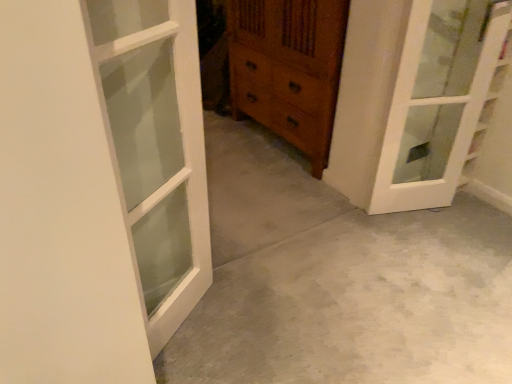
Question: Looking at the image, does wooden chest of drawers at center seem bigger or smaller compared to white glass door at upper right, which is counted as the first door, starting from the right?

Choices:
 (A) small
 (B) big

Answer: (B)

Question: Looking at their shapes, would you say wooden chest of drawers at center is wider or thinner than white glass door at upper right, which is counted as the first door, starting from the right?

Choices:
 (A) thin
 (B) wide

Answer: (B)

Question: Considering the real-world distances, which object is closest to the gray concrete at center?

Choices:
 (A) wooden chest of drawers at center
 (B) white wood door at left, placed as the 1th door when sorted from left to right
 (C) white glass door at upper right, which is counted as the first door, starting from the right

Answer: (C)

Question: Estimate the real-world distances between objects in this image. Which object is closer to the white wood door at left, which appears as the second door when viewed from the back?

Choices:
 (A) white glass door at upper right, acting as the second door starting from the left
 (B) gray concrete at center
 (C) wooden chest of drawers at center

Answer: (B)